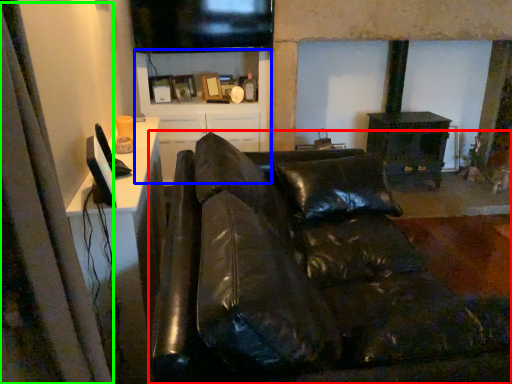
Question: Which object is the farthest from studio couch (highlighted by a red box)? Choose among these: tv cabinet (highlighted by a blue box) or curtain (highlighted by a green box).

Choices:
 (A) tv cabinet
 (B) curtain

Answer: (A)